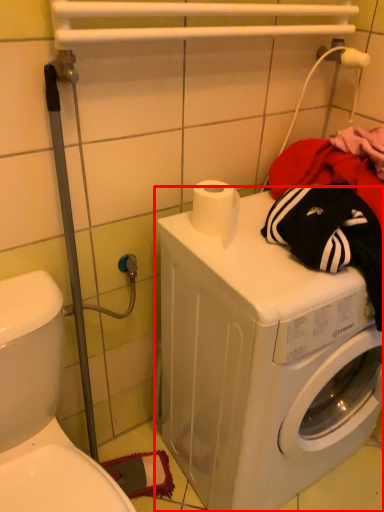
Question: From the image's perspective, where is washing machine (annotated by the red box) located in relation to washer in the image?

Choices:
 (A) below
 (B) above

Answer: (B)